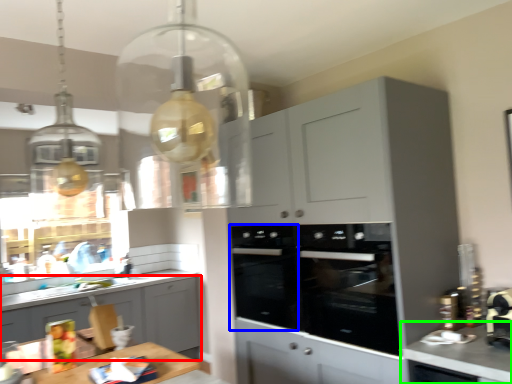
Question: Which object is the farthest from cabinetry (highlighted by a red box)? Choose among these: oven (highlighted by a blue box) or countertop (highlighted by a green box).

Choices:
 (A) oven
 (B) countertop

Answer: (B)